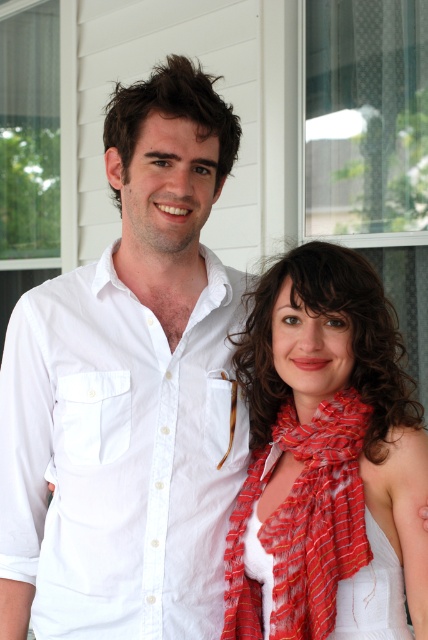
Question: Which point is closer to the camera?

Choices:
 (A) white satin dress at lower right
 (B) red striped scarf at center
 (C) white cotton shirt at center
 (D) striped silk scarf at center

Answer: (B)

Question: Which point is closer to the camera taking this photo?

Choices:
 (A) (317, 628)
 (B) (202, 419)

Answer: (A)

Question: Can you confirm if white cotton shirt at center is wider than white satin dress at lower right?

Choices:
 (A) no
 (B) yes

Answer: (B)

Question: Does white cotton shirt at center have a lesser width compared to striped silk scarf at center?

Choices:
 (A) yes
 (B) no

Answer: (B)

Question: Can you confirm if striped silk scarf at center is positioned above white satin dress at lower right?

Choices:
 (A) yes
 (B) no

Answer: (A)

Question: Which of the following is the closest to the observer?

Choices:
 (A) red striped scarf at center
 (B) white cotton shirt at center
 (C) striped silk scarf at center

Answer: (A)